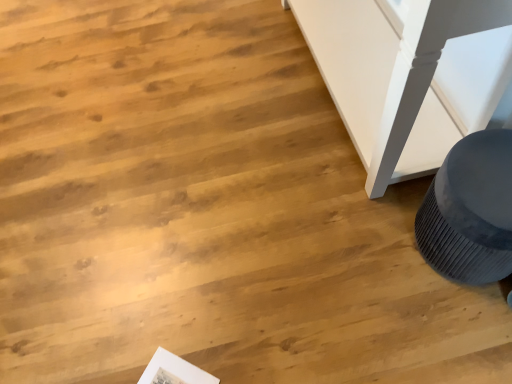
Where is `free area in between matte gray speaker at lower right and white paper at lower left`? The height and width of the screenshot is (384, 512). free area in between matte gray speaker at lower right and white paper at lower left is located at coordinates (328, 313).